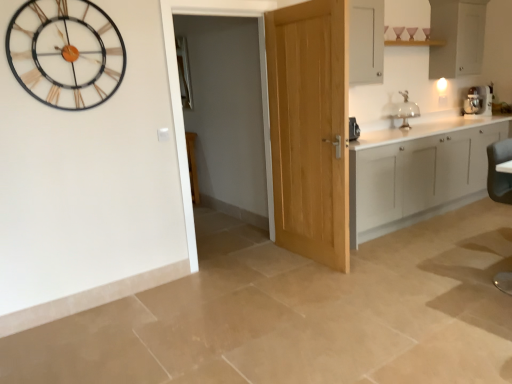
Measure the distance between light oak door at center and camera.

A distance of 2.75 meters exists between light oak door at center and camera.

Where is `black leather swivel chair at lower right`? Image resolution: width=512 pixels, height=384 pixels. black leather swivel chair at lower right is located at coordinates (499, 172).

This screenshot has height=384, width=512. I want to click on light oak door at center, so click(x=310, y=129).

What's the angular difference between white matte cabinet at upper right, which ranks as the first cabinetry in top-to-bottom order, and black leather swivel chair at lower right's facing directions?

They differ by 1.6 degrees in their facing directions.

Is white matte cabinet at upper right, which ranks as the first cabinetry in top-to-bottom order, taller than black leather swivel chair at lower right?

Incorrect, the height of white matte cabinet at upper right, which ranks as the first cabinetry in top-to-bottom order, is not larger of that of black leather swivel chair at lower right.

Is white matte cabinet at upper right, which ranks as the 2th cabinetry in bottom-to-top order, smaller than black leather swivel chair at lower right?

Incorrect, white matte cabinet at upper right, which ranks as the 2th cabinetry in bottom-to-top order, is not smaller in size than black leather swivel chair at lower right.

Starting from the black leather swivel chair at lower right, which cabinetry is the 2nd one behind? Please provide its 2D coordinates.

[(457, 37)]

Are clear glass cake stand at upper right and white matte cabinet at upper right, which ranks as the 2th cabinetry in bottom-to-top order, making contact?

No, clear glass cake stand at upper right is not with white matte cabinet at upper right, which ranks as the 2th cabinetry in bottom-to-top order.

Would you say white matte cabinet at upper right, which ranks as the 2th cabinetry in bottom-to-top order, is part of clear glass cake stand at upper right's contents?

No.

Does clear glass cake stand at upper right turn towards white matte cabinet at upper right, which ranks as the first cabinetry in top-to-bottom order?

No, clear glass cake stand at upper right is not aimed at white matte cabinet at upper right, which ranks as the first cabinetry in top-to-bottom order.

From their relative heights in the image, would you say clear glass cake stand at upper right is taller or shorter than white matte cabinet at upper right, which ranks as the first cabinetry in top-to-bottom order?

In the image, clear glass cake stand at upper right appears to be shorter than white matte cabinet at upper right, which ranks as the first cabinetry in top-to-bottom order.

Who is more distant, white matte cabinet at upper right, which ranks as the 2th cabinetry in bottom-to-top order, or light oak door at center?

white matte cabinet at upper right, which ranks as the 2th cabinetry in bottom-to-top order, is more distant.

From a real-world perspective, is white matte cabinet at upper right, which ranks as the 2th cabinetry in bottom-to-top order, on light oak door at center?

Yes, from a real-world perspective, white matte cabinet at upper right, which ranks as the 2th cabinetry in bottom-to-top order, is on top of light oak door at center.

Is white matte cabinet at upper right, which ranks as the 2th cabinetry in bottom-to-top order, to the right of light oak door at center from the viewer's perspective?

Indeed, white matte cabinet at upper right, which ranks as the 2th cabinetry in bottom-to-top order, is positioned on the right side of light oak door at center.

Is white matte cabinetry at right, the 1th cabinetry ordered from the bottom, next to clear glass cake stand at upper right?

white matte cabinetry at right, the 1th cabinetry ordered from the bottom, is not next to clear glass cake stand at upper right, and they're not touching.

In the scene shown: Who is taller, white matte cabinetry at right, marked as the second cabinetry in a top-to-bottom arrangement, or clear glass cake stand at upper right?

Standing taller between the two is white matte cabinetry at right, marked as the second cabinetry in a top-to-bottom arrangement.

From a real-world perspective, relative to clear glass cake stand at upper right, is white matte cabinetry at right, marked as the second cabinetry in a top-to-bottom arrangement, vertically above or below?

white matte cabinetry at right, marked as the second cabinetry in a top-to-bottom arrangement, is below clear glass cake stand at upper right.

Is white matte cabinetry at right, marked as the second cabinetry in a top-to-bottom arrangement, positioned with its back to clear glass cake stand at upper right?

No.

From a real-world perspective, which object stands above the other?

black leather swivel chair at lower right.

Which object is thinner, black leather swivel chair at lower right or white matte cabinetry at right, the 1th cabinetry ordered from the bottom?

Thinner between the two is black leather swivel chair at lower right.

In the image, is black leather swivel chair at lower right on the left side or the right side of white matte cabinetry at right, marked as the second cabinetry in a top-to-bottom arrangement?

Clearly, black leather swivel chair at lower right is on the right of white matte cabinetry at right, marked as the second cabinetry in a top-to-bottom arrangement, in the image.

From the image's perspective, between black leather swivel chair at lower right and white matte cabinetry at right, the 1th cabinetry ordered from the bottom, who is located below?

black leather swivel chair at lower right.

From a real-world perspective, is white plastic coffee machine at upper right physically above white matte cabinet at upper right, which ranks as the 2th cabinetry in bottom-to-top order?

No, from a real-world perspective, white plastic coffee machine at upper right is not over white matte cabinet at upper right, which ranks as the 2th cabinetry in bottom-to-top order

Which of these two, white plastic coffee machine at upper right or white matte cabinet at upper right, which ranks as the 2th cabinetry in bottom-to-top order, is thinner?

Thinner between the two is white plastic coffee machine at upper right.

Would you consider white plastic coffee machine at upper right to be distant from white matte cabinet at upper right, which ranks as the first cabinetry in top-to-bottom order?

No.

Could you tell me if white plastic coffee machine at upper right is facing white matte cabinet at upper right, which ranks as the first cabinetry in top-to-bottom order?

No, white plastic coffee machine at upper right is not turned towards white matte cabinet at upper right, which ranks as the first cabinetry in top-to-bottom order.

Considering the positions of objects clear glass cake stand at upper right and light oak door at center in the image provided, who is in front, clear glass cake stand at upper right or light oak door at center?

light oak door at center is in front.

Can you tell me how much clear glass cake stand at upper right and light oak door at center differ in facing direction?

They differ by 90.7 degrees in their facing directions.

Does clear glass cake stand at upper right touch light oak door at center?

There is a gap between clear glass cake stand at upper right and light oak door at center.

Is clear glass cake stand at upper right facing away from light oak door at center?

clear glass cake stand at upper right is not turned away from light oak door at center.

Identify the location of the 2nd cabinetry above the black leather swivel chair at lower right (from the image's perspective). The height and width of the screenshot is (384, 512). (457, 37).

The width and height of the screenshot is (512, 384). Identify the location of sink located in front of the white matte cabinet at upper right, which ranks as the 2th cabinetry in bottom-to-top order. (404, 111).

From the image, which object appears to be farther from metallic gold and black wall clock at upper left, white matte cabinet at upper right, which ranks as the 2th cabinetry in bottom-to-top order, or white plastic coffee machine at upper right?

Among the two, white matte cabinet at upper right, which ranks as the 2th cabinetry in bottom-to-top order, is located further to metallic gold and black wall clock at upper left.

Looking at the image, which one is located further to clear glass cake stand at upper right, white matte cabinetry at right, the 1th cabinetry ordered from the bottom, or metallic gold and black wall clock at upper left?

The object further to clear glass cake stand at upper right is metallic gold and black wall clock at upper left.

Looking at the image, which one is located further to white matte cabinetry at right, marked as the second cabinetry in a top-to-bottom arrangement, black leather swivel chair at lower right or clear glass cake stand at upper right?

black leather swivel chair at lower right lies further to white matte cabinetry at right, marked as the second cabinetry in a top-to-bottom arrangement, than the other object.

From the image, which object appears to be farther from white matte cabinetry at right, the 1th cabinetry ordered from the bottom, light oak door at center or black leather swivel chair at lower right?

The object further to white matte cabinetry at right, the 1th cabinetry ordered from the bottom, is black leather swivel chair at lower right.

Estimate the real-world distances between objects in this image. Which object is closer to white matte cabinetry at right, the 1th cabinetry ordered from the bottom, white matte cabinet at upper right, which ranks as the 2th cabinetry in bottom-to-top order, or black leather swivel chair at lower right?

black leather swivel chair at lower right lies closer to white matte cabinetry at right, the 1th cabinetry ordered from the bottom, than the other object.

Which object lies nearer to the anchor point white matte cabinet at upper right, which ranks as the first cabinetry in top-to-bottom order, white plastic coffee machine at upper right or white matte cabinetry at right, the 1th cabinetry ordered from the bottom?

white plastic coffee machine at upper right lies closer to white matte cabinet at upper right, which ranks as the first cabinetry in top-to-bottom order, than the other object.

Looking at the image, which one is located closer to black leather swivel chair at lower right, light oak door at center or white matte cabinet at upper right, which ranks as the first cabinetry in top-to-bottom order?

white matte cabinet at upper right, which ranks as the first cabinetry in top-to-bottom order, lies closer to black leather swivel chair at lower right than the other object.

Looking at the image, which one is located further to white matte cabinet at upper right, which ranks as the first cabinetry in top-to-bottom order, metallic gold and black wall clock at upper left or light oak door at center?

Among the two, metallic gold and black wall clock at upper left is located further to white matte cabinet at upper right, which ranks as the first cabinetry in top-to-bottom order.

Image resolution: width=512 pixels, height=384 pixels. Find the location of `cabinetry situated between metallic gold and black wall clock at upper left and black leather swivel chair at lower right from left to right`. cabinetry situated between metallic gold and black wall clock at upper left and black leather swivel chair at lower right from left to right is located at coordinates (418, 172).

Locate an element on the screen. This screenshot has width=512, height=384. sink between black leather swivel chair at lower right and white matte cabinet at upper right, which ranks as the first cabinetry in top-to-bottom order, in the front-back direction is located at coordinates (404, 111).

Image resolution: width=512 pixels, height=384 pixels. Find the location of `door between black leather swivel chair at lower right and white plastic coffee machine at upper right in the front-back direction`. door between black leather swivel chair at lower right and white plastic coffee machine at upper right in the front-back direction is located at coordinates (310, 129).

Locate an element on the screen. swivel chair between metallic gold and black wall clock at upper left and white matte cabinet at upper right, which ranks as the 2th cabinetry in bottom-to-top order, from left to right is located at coordinates (499, 172).